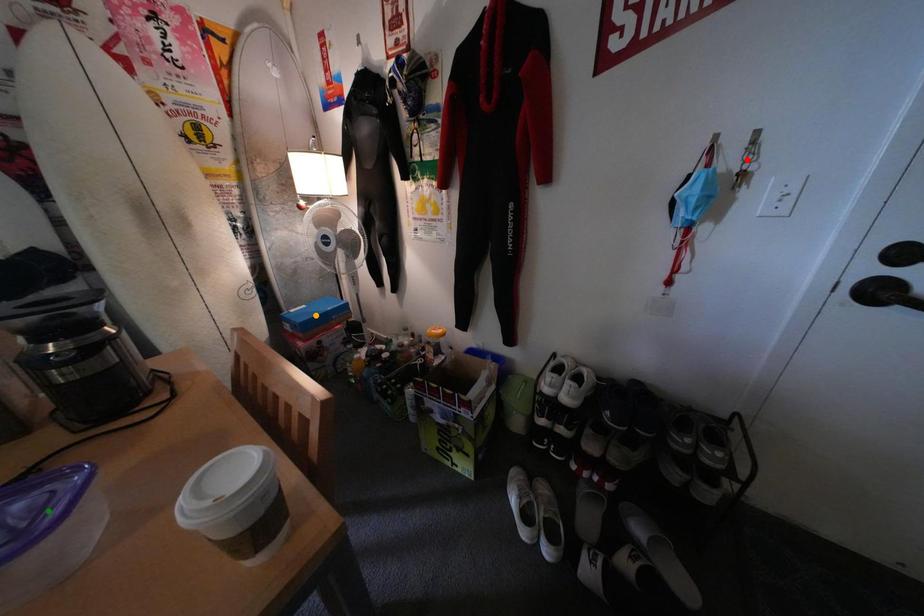
Order these from nearest to farthest:
- orange point
- red point
- green point

green point → red point → orange point